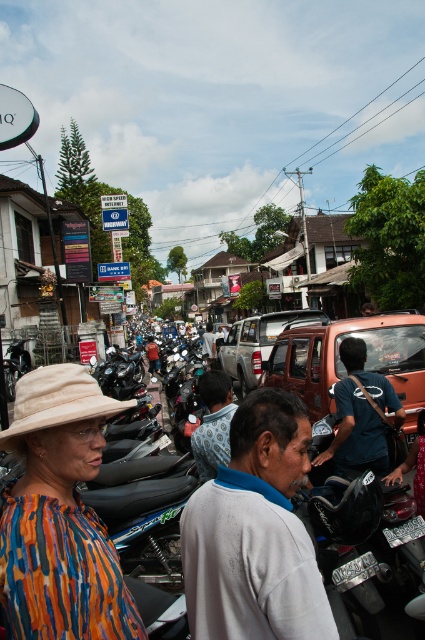
You are a pedestrian trying to cross the street. You see a gray cotton shirt at center and a blue denim shirt at center. Which person is blocking your path more?

The gray cotton shirt at center is positioned over blue denim shirt at center, so the gray cotton shirt at center is blocking your path more.

You are a delivery person trying to navigate through the congested street. You need to move your orange matte truck at center to the right to let a motorcycle pass. Is the metallic silver motorcycle at center currently blocking the path of your truck?

The metallic silver motorcycle at center is to the left of the orange matte truck at center, so it is not blocking the truck. The truck can move to the right without obstruction.